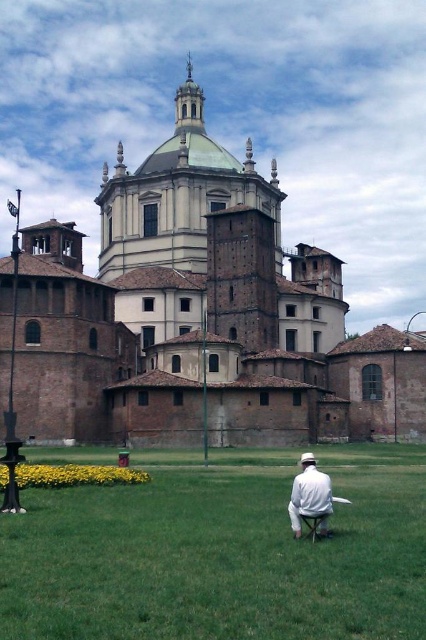
You are standing in the grassy area in front of the historic buildings. You see the brown brick church at center and the white cotton shirt at center. Which object is closer to your left side?

The brown brick church at center is to the left of the white cotton shirt at center, so it is closer to your left side.

You are a visitor standing in front of the historic building complex. You notice the green grass at center and the white cotton shirt at center. Which object is closer to the ground?

The green grass at center is closer to the ground as it is shorter than the white cotton shirt at center.

You are a tourist standing in the grassy area and want to take a photo of the brown brick church at center. Since the green grass at center is in front of you, will the church be fully visible in your photo?

The brown brick church at center is taller than the green grass at center, so the church will be fully visible in your photo.